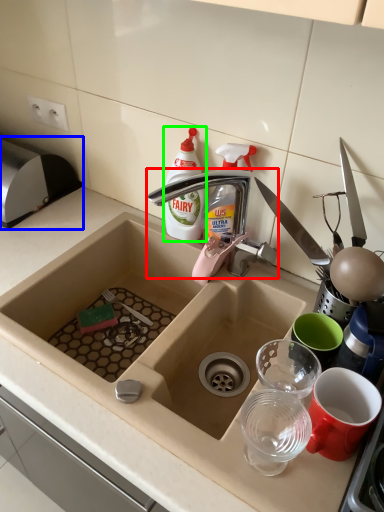
Question: Which object is the farthest from tap (highlighted by a red box)? Choose among these: appliance (highlighted by a blue box) or bottle (highlighted by a green box).

Choices:
 (A) appliance
 (B) bottle

Answer: (A)